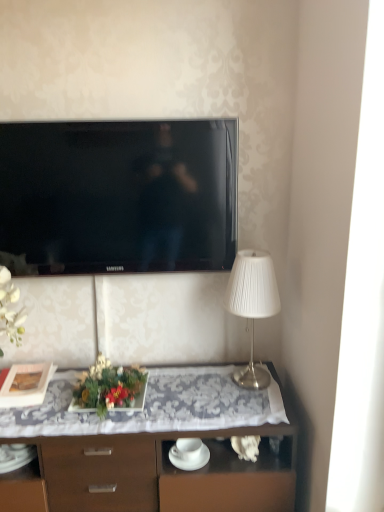
Find the location of `vacant point above black glossy tv at upper center (from a real-world perspective)`. vacant point above black glossy tv at upper center (from a real-world perspective) is located at coordinates (132, 117).